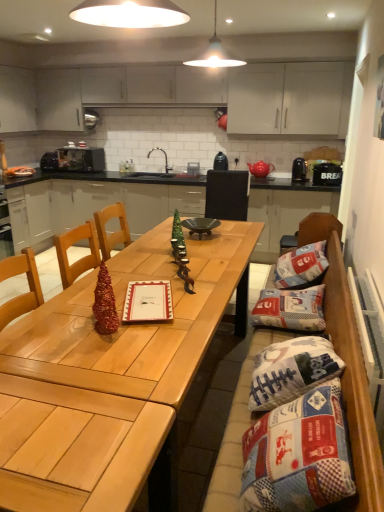
Question: From a real-world perspective, is shiny metallic christmas tree at center, acting as the second christmas tree starting from the back, on metallic microwave at upper left, the second appliance when ordered from left to right?

Choices:
 (A) no
 (B) yes

Answer: (A)

Question: Is shiny metallic christmas tree at center, which is counted as the first christmas tree, starting from the front, turned away from metallic microwave at upper left, the fourth appliance in the right-to-left sequence?

Choices:
 (A) no
 (B) yes

Answer: (A)

Question: Is shiny metallic christmas tree at center, the second christmas tree from the top, closer to camera compared to metallic microwave at upper left, the second appliance when ordered from left to right?

Choices:
 (A) yes
 (B) no

Answer: (A)

Question: Is shiny metallic christmas tree at center, placed as the 2th christmas tree when sorted from right to left, to the left of metallic microwave at upper left, the second appliance when ordered from left to right, from the viewer's perspective?

Choices:
 (A) yes
 (B) no

Answer: (B)

Question: From the image's perspective, is shiny metallic christmas tree at center, the 1th christmas tree viewed from the left, beneath metallic microwave at upper left, the second appliance when ordered from left to right?

Choices:
 (A) no
 (B) yes

Answer: (B)

Question: Is wooden table at center in front of or behind wooden chair at center in the image?

Choices:
 (A) behind
 (B) front

Answer: (A)

Question: From a real-world perspective, is wooden table at center physically located above or below wooden chair at center?

Choices:
 (A) below
 (B) above

Answer: (A)

Question: Does point (284, 195) appear closer or farther from the camera than point (210, 183)?

Choices:
 (A) closer
 (B) farther

Answer: (B)

Question: In terms of height, does wooden table at center look taller or shorter compared to wooden chair at center?

Choices:
 (A) short
 (B) tall

Answer: (A)

Question: From a real-world perspective, is shiny metallic christmas tree at center, the second christmas tree from the top, above or below shiny wood table at center?

Choices:
 (A) below
 (B) above

Answer: (B)

Question: Is shiny metallic christmas tree at center, positioned as the 1th christmas tree in bottom-to-top order, bigger or smaller than shiny wood table at center?

Choices:
 (A) small
 (B) big

Answer: (A)

Question: Is shiny metallic christmas tree at center, which is counted as the first christmas tree, starting from the front, inside the boundaries of shiny wood table at center, or outside?

Choices:
 (A) outside
 (B) inside

Answer: (A)

Question: Considering their positions, is shiny metallic christmas tree at center, placed as the 2th christmas tree when sorted from right to left, located in front of or behind shiny wood table at center?

Choices:
 (A) front
 (B) behind

Answer: (B)

Question: In the image, is black matte microwave at left, which is counted as the first appliance, starting from the left, positioned in front of or behind black plastic bread bin at right, placed as the 5th appliance when sorted from left to right?

Choices:
 (A) behind
 (B) front

Answer: (A)

Question: From the image's perspective, is black matte microwave at left, arranged as the 5th appliance when viewed from the right, above or below black plastic bread bin at right, placed as the 5th appliance when sorted from left to right?

Choices:
 (A) above
 (B) below

Answer: (A)